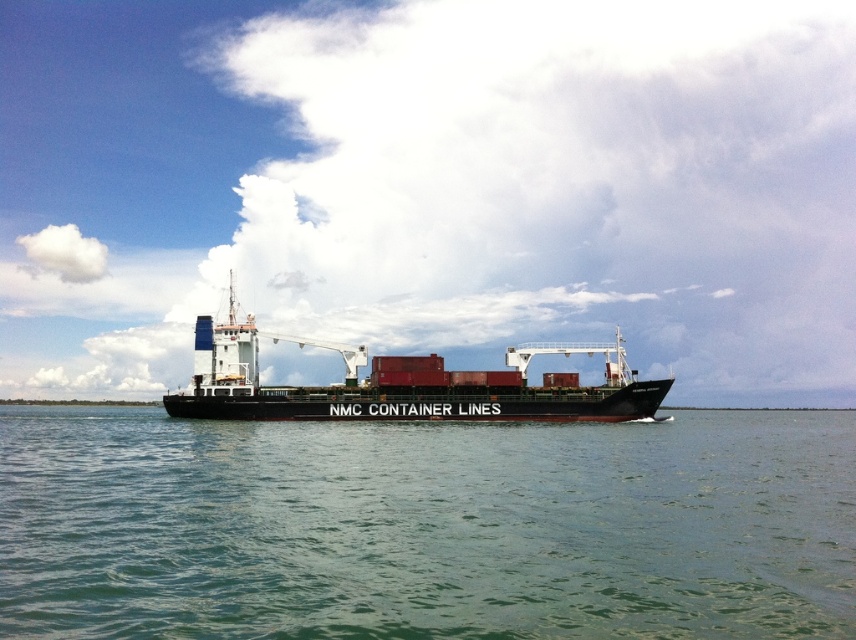
Question: Which of the following is the closest to the observer?

Choices:
 (A) (366, 433)
 (B) (247, 404)

Answer: (A)

Question: Is green water at center below black matte container ship at center?

Choices:
 (A) yes
 (B) no

Answer: (A)

Question: Can you confirm if green water at center is positioned below black matte container ship at center?

Choices:
 (A) no
 (B) yes

Answer: (B)

Question: Which point is closer to the camera?

Choices:
 (A) (299, 499)
 (B) (476, 394)

Answer: (A)

Question: Does green water at center appear under black matte container ship at center?

Choices:
 (A) yes
 (B) no

Answer: (A)